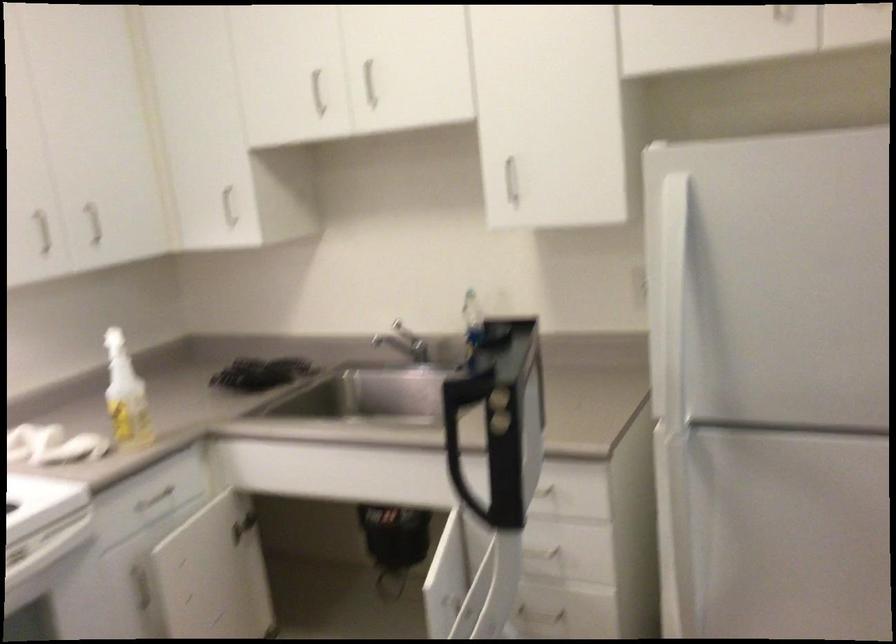
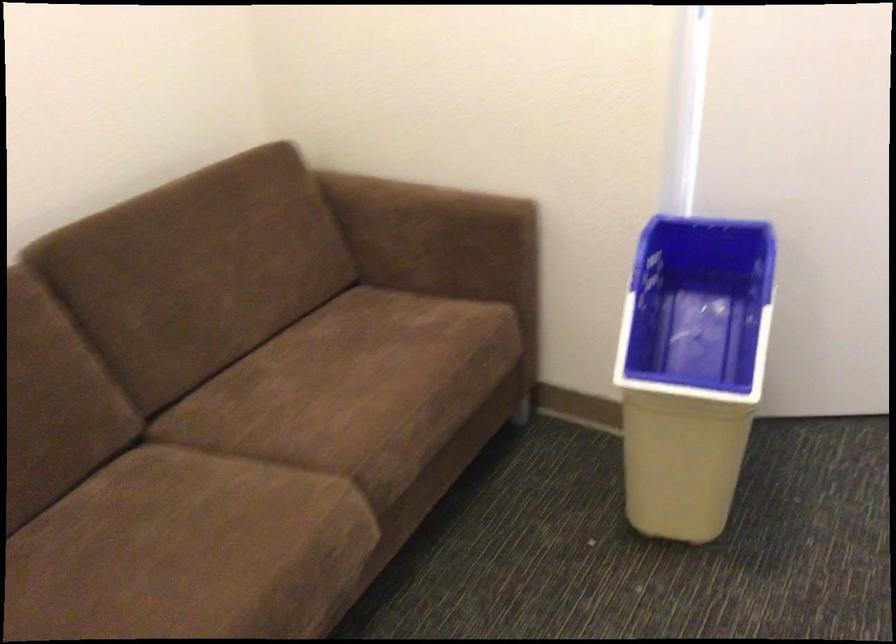
How did the camera likely rotate?

The camera's rotation is toward right-down.